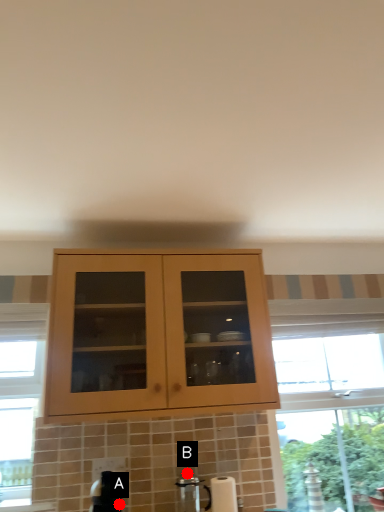
Question: Two points are circled on the image, labeled by A and B beside each circle. Which point is closer to the camera?

Choices:
 (A) A is closer
 (B) B is closer

Answer: (A)